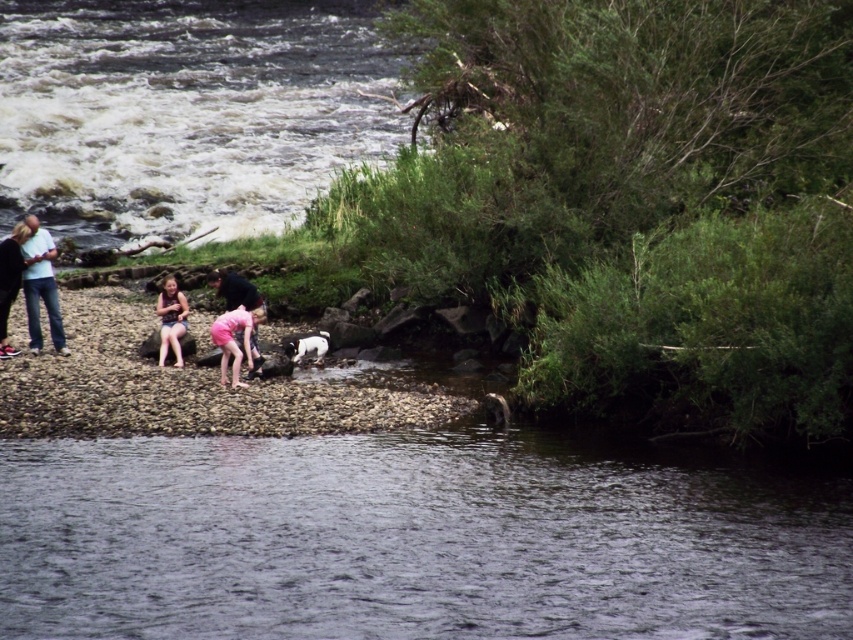
Question: Can you confirm if matte blue jeans at left is positioned to the left of matte black jacket at left?

Choices:
 (A) no
 (B) yes

Answer: (A)

Question: Can you confirm if white frothy water at lower left is bigger than black and white fur dog at center?

Choices:
 (A) no
 (B) yes

Answer: (B)

Question: Which object appears farthest from the camera in this image?

Choices:
 (A) pink fabric dress at center
 (B) white frothy water at lower left
 (C) black and white fur dog at center
 (D) matte black jacket at left

Answer: (B)

Question: Which point appears farthest from the camera in this image?

Choices:
 (A) (0, 330)
 (B) (706, 513)

Answer: (A)

Question: Which of the following is the farthest from the observer?

Choices:
 (A) black and white fur dog at center
 (B) pink fabric at lower left

Answer: (A)

Question: Does clear water at lower left have a lesser width compared to matte blue jeans at left?

Choices:
 (A) yes
 (B) no

Answer: (B)